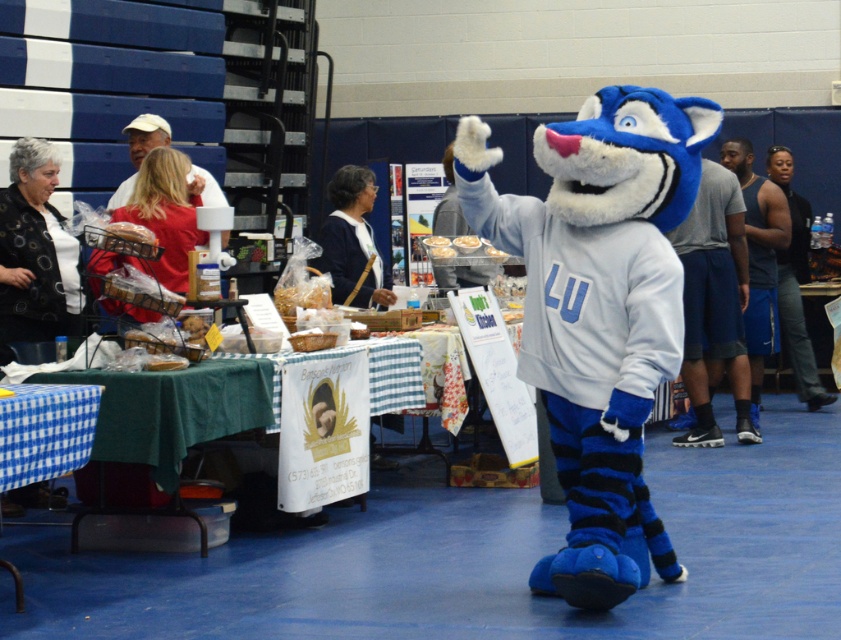
You are organizing a party and need to place the smooth white cake at center on the green checkered tablecloth at lower left. Can the cake fit on the tablecloth?

The green checkered tablecloth at lower left is bigger than the smooth white cake at center, so yes, the cake can fit on the tablecloth.

You are a guest at the event and want to place a small gift on the smooth white cake at center. The gift is as wide as the green checkered tablecloth at lower left. Will the gift fit on the cake?

The green checkered tablecloth at lower left is wider than the smooth white cake at center, so the gift, which is as wide as the tablecloth, will not fit on the cake.